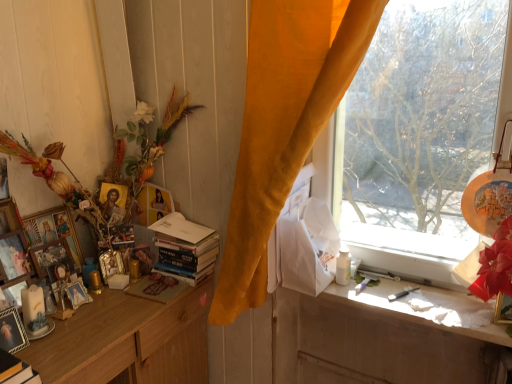
The image size is (512, 384). I want to click on blank area to the left of matte brown magazine at center, so click(x=111, y=302).